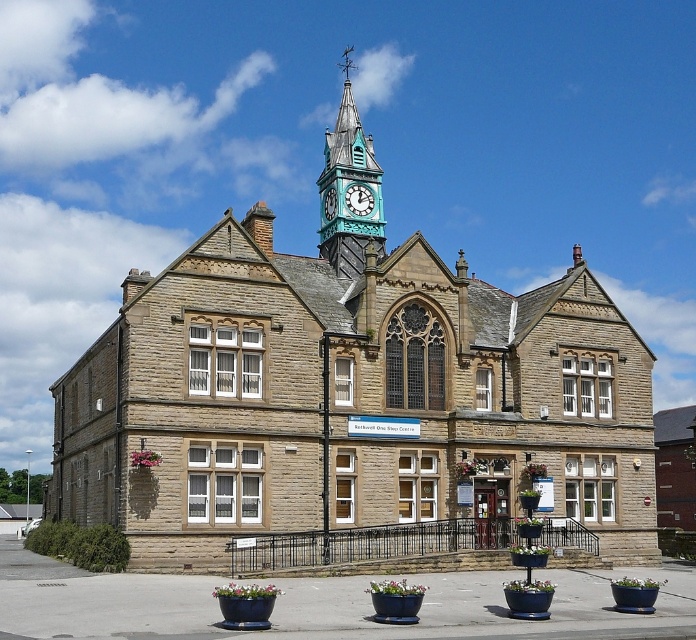
You are standing at the base of the historic building with the clock tower. You want to take a photo of the clock tower from a distance that allows you to capture the entire structure in one frame. Given that your camera has a standard lens with a field of view of 50 degrees, can you estimate if the point at coordinates point (x=367, y=212) is within the camera frame when positioned at this distance?

The point at coordinates point (x=367, y=212) is 236.38 feet away from the camera. To determine if it fits within the 50 degree field of view, we can calculate the maximum distance that corresponds to half the field of view. Using trigonometry, tan 25 degrees multiplied by 236.38 feet gives approximately 104 feet. If the structure width at that distance is less than 104 feet, the point would be within frame. However, without knowing the building dimensions, we can only confirm the distance matches the given 2

You are an architect reviewing the design of the historic building. You notice two clocks on the clock tower. Which one is wider between the teal glass clock at upper center and the teal metallic clock at upper center?

The teal glass clock at upper center is wider than the teal metallic clock at upper center.

You are standing in front of the historic building and want to take a photo of both the teal glass clock tower at upper center and the teal glass clock at upper center. Which one will appear larger in your photo?

The teal glass clock tower at upper center will appear larger in the photo because it is closer to the viewer than the teal glass clock at upper center.